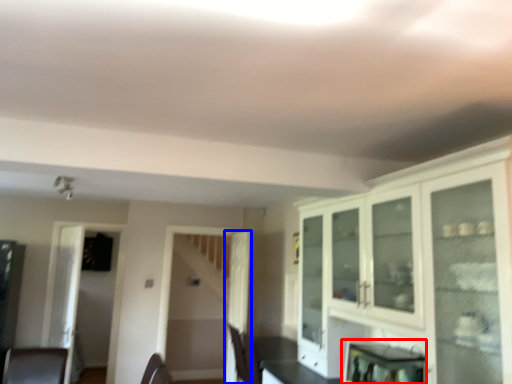
Question: Which object appears farthest to the camera in this image, appliance (highlighted by a red box) or door (highlighted by a blue box)?

Choices:
 (A) appliance
 (B) door

Answer: (B)